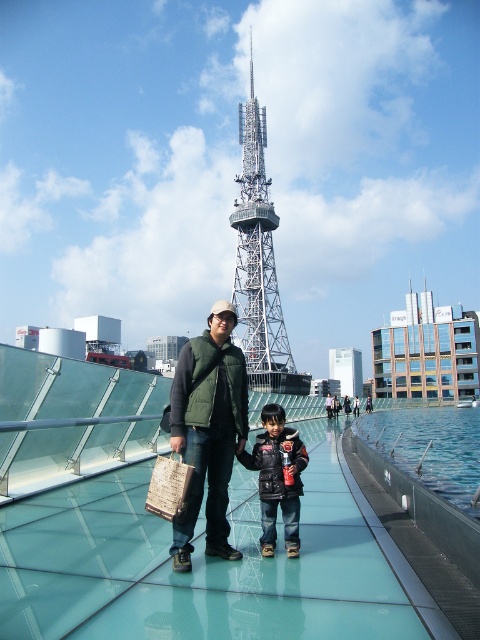
This screenshot has height=640, width=480. What do you see at coordinates (207, 429) in the screenshot?
I see `green fabric vest at center` at bounding box center [207, 429].

Does green fabric vest at center have a lesser width compared to metallic lattice tower at center?

Yes.

You are a GUI agent. You are given a task and a screenshot of the screen. Output one action in this format:
    pyautogui.click(x=<x>, y=<y>)
    Task: Click on the green fabric vest at center
    
    Given the screenshot: What is the action you would take?
    pyautogui.click(x=207, y=429)

Between metallic lattice tower at center and black leather jacket at center, which one has more height?

metallic lattice tower at center

Is metallic lattice tower at center bigger than black leather jacket at center?

Correct, metallic lattice tower at center is larger in size than black leather jacket at center.

Is point (265, 243) positioned before point (296, 451)?

No, (265, 243) is behind (296, 451).

You are a GUI agent. You are given a task and a screenshot of the screen. Output one action in this format:
    pyautogui.click(x=<x>, y=<y>)
    Task: Click on the metallic lattice tower at center
    This screenshot has width=480, height=640.
    Given the screenshot: What is the action you would take?
    pyautogui.click(x=260, y=262)

Based on the photo, who is taller, green fabric vest at center or black leather jacket at center?

green fabric vest at center is taller.

Does point (215, 506) come closer to viewer compared to point (262, 545)?

No, it is behind (262, 545).

The image size is (480, 640). What are the coordinates of `green fabric vest at center` in the screenshot? It's located at (207, 429).